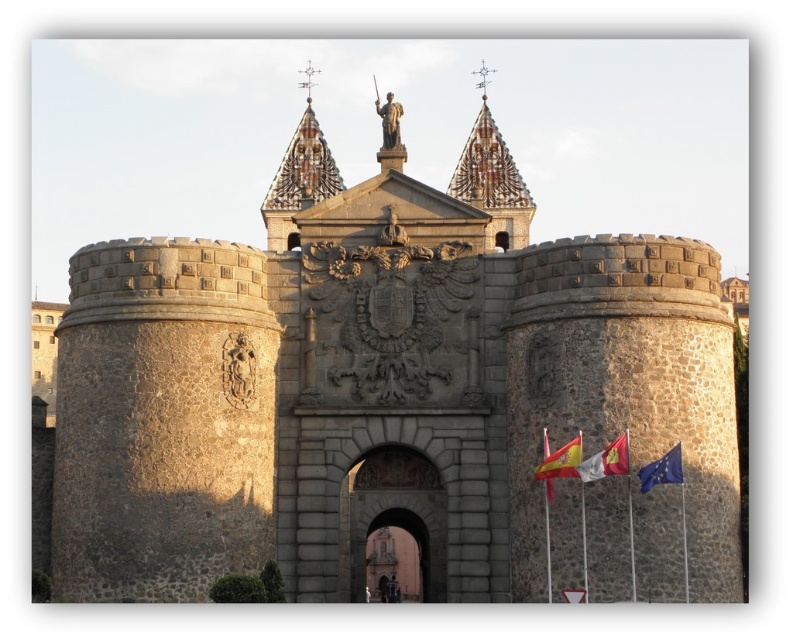
Question: Among these points, which one is nearest to the camera?

Choices:
 (A) (561, 464)
 (B) (381, 524)
 (C) (608, 452)

Answer: (C)

Question: Can you confirm if stone archway at center is positioned to the left of yellow fabric flag at center?

Choices:
 (A) yes
 (B) no

Answer: (A)

Question: Can you confirm if yellow fabric flag at center is positioned below blue fabric flag at lower right?

Choices:
 (A) yes
 (B) no

Answer: (B)

Question: Which point is closer to the camera taking this photo?

Choices:
 (A) (669, 454)
 (B) (600, 472)

Answer: (B)

Question: Which is nearer to the red fabric flag at center?

Choices:
 (A) white fabric flag at lower right
 (B) stone archway at center
 (C) blue fabric flag at lower right

Answer: (A)

Question: Does blue fabric flag at lower right appear under red fabric flag at center?

Choices:
 (A) no
 (B) yes

Answer: (A)